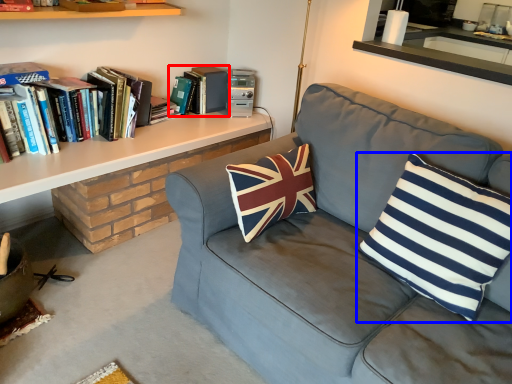
Question: Which object appears farthest to the camera in this image, book (highlighted by a red box) or pillow (highlighted by a blue box)?

Choices:
 (A) book
 (B) pillow

Answer: (A)